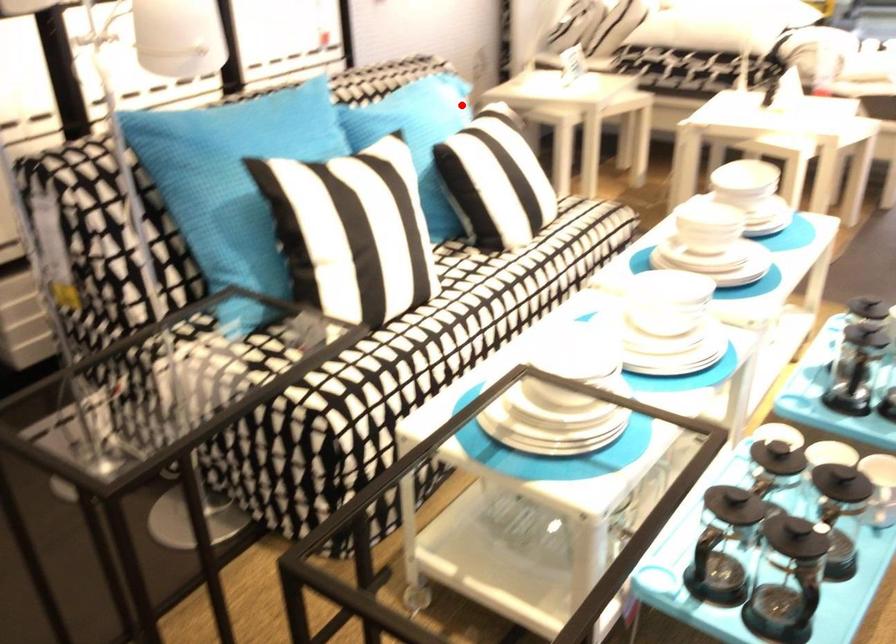
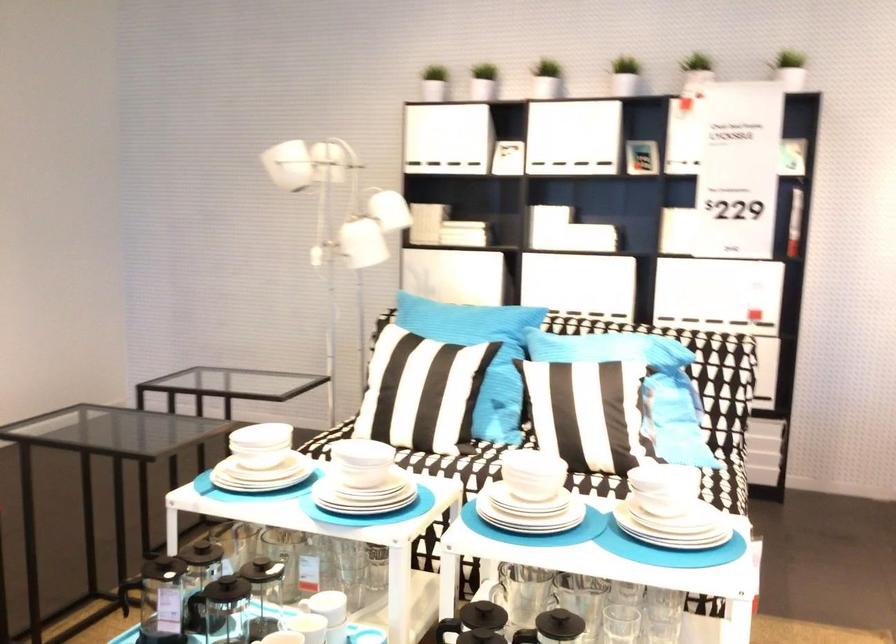
Where in the second image is the point corresponding to the highlighted location from the first image?

(615, 345)